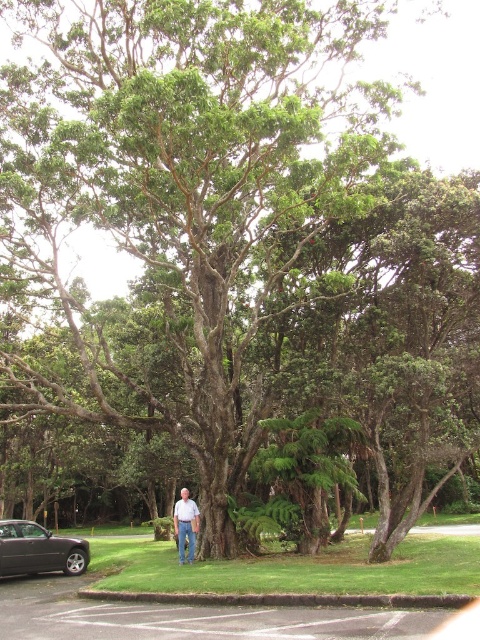
You are standing at the base of the tree and want to take a photo of the dark gray metallic car at lower left and the white cotton shirt at center. Which object is closer to the camera?

The dark gray metallic car at lower left is shorter than the white cotton shirt at center, so the car is closer to the camera because it is shorter and appears lower in the frame.

You are standing at the base of the tree and want to place a small bench between the two points, point (62, 570) and point (195, 529). Which point should the bench be closer to in order to be closer to the viewer?

The bench should be closer to point (62, 570) because it is further to the viewer than point (195, 529).

You are planning to take a photo of the white cotton shirt at center and the dark gray metallic car at lower left. Which object should you focus on first if you want to capture both in the frame without moving the camera?

You should focus on the white cotton shirt at center first because it occupies more space in the frame than the dark gray metallic car at lower left, ensuring it is properly in focus before adjusting for the smaller object.